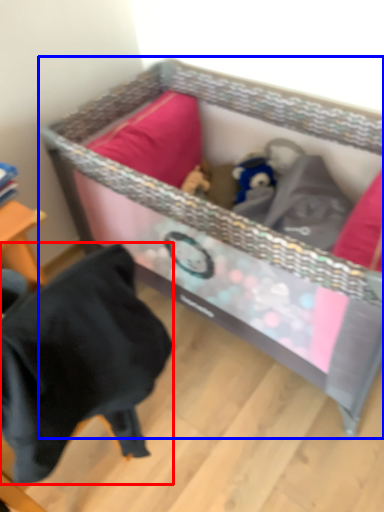
Question: Which point is closer to the camera, clothing (highlighted by a red box) or infant bed (highlighted by a blue box)?

Choices:
 (A) clothing
 (B) infant bed

Answer: (A)